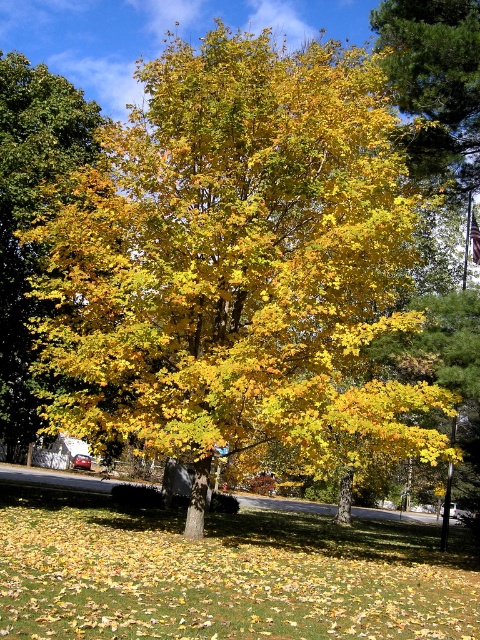
Question: Which of the following is the farthest from the observer?

Choices:
 (A) yellow/golden leaves at center
 (B) golden yellow leaves at upper right
 (C) yellow-green leaves at center

Answer: (B)

Question: Can you confirm if yellow-green leaves at center is positioned to the left of golden yellow leaves at upper right?

Choices:
 (A) no
 (B) yes

Answer: (B)

Question: Does yellow-green leaves at center have a larger size compared to golden yellow leaves at upper right?

Choices:
 (A) no
 (B) yes

Answer: (B)

Question: Which point appears closest to the camera in this image?

Choices:
 (A) (21, 163)
 (B) (431, 12)
 (C) (469, 545)

Answer: (B)

Question: Estimate the real-world distances between objects in this image. Which object is farther from the yellow/golden leaves at center?

Choices:
 (A) yellow-green leaves at center
 (B) golden yellow leaves at upper right

Answer: (B)

Question: Is yellow-green leaves at center below golden yellow leaves at upper right?

Choices:
 (A) no
 (B) yes

Answer: (B)